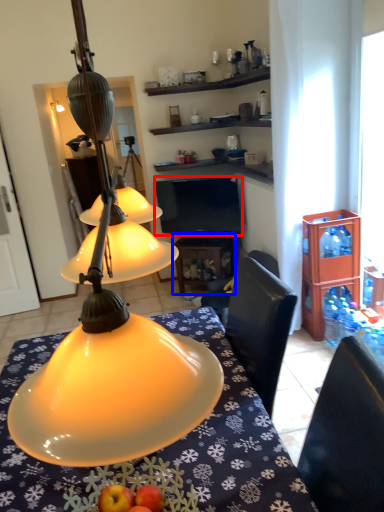
Question: Which object appears farthest to the camera in this image, television (highlighted by a red box) or table (highlighted by a blue box)?

Choices:
 (A) television
 (B) table

Answer: (B)